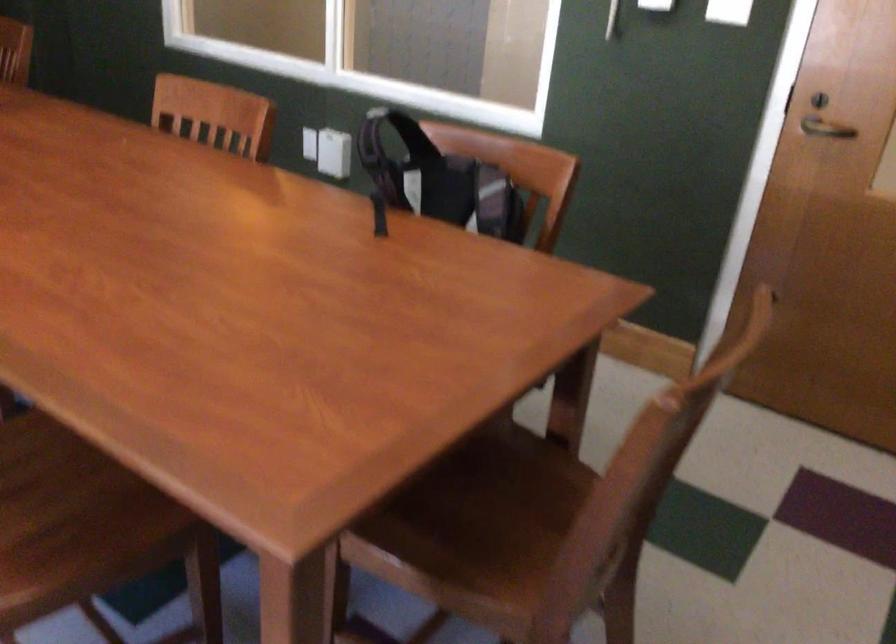
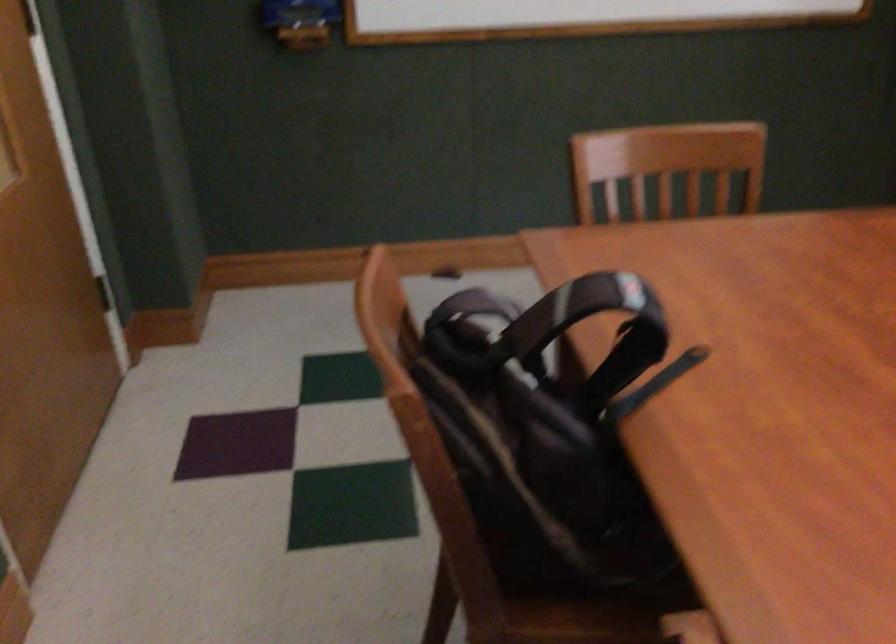
The point at (366, 114) is marked in the first image. Where is the corresponding point in the second image?

(625, 297)